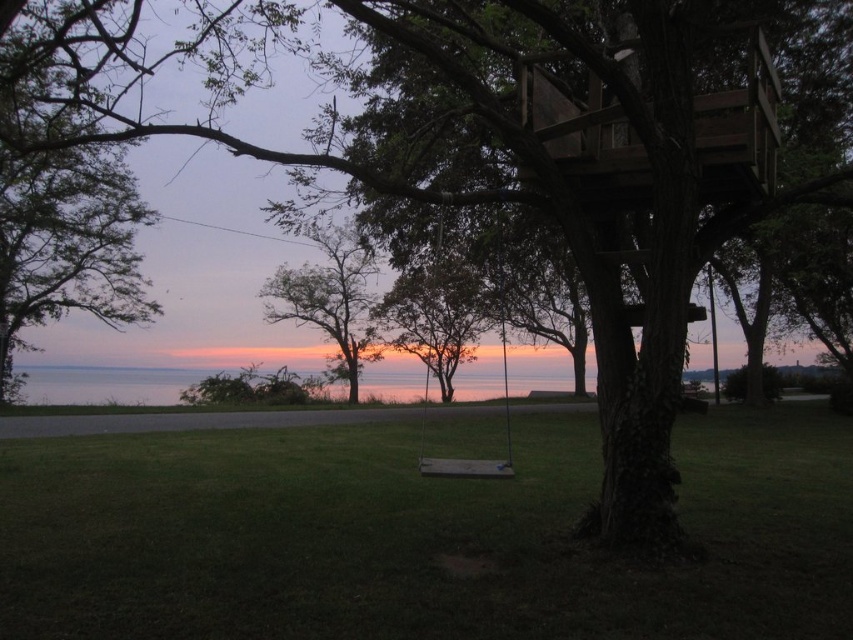
Question: Can you confirm if smooth bark tree at center is positioned to the right of wooden swing at center?

Choices:
 (A) no
 (B) yes

Answer: (A)

Question: Is smooth bark tree at center above wooden swing at center?

Choices:
 (A) yes
 (B) no

Answer: (A)

Question: Which point is closer to the camera taking this photo?

Choices:
 (A) (473, 273)
 (B) (384, 611)
 (C) (369, 344)
 (D) (503, 349)

Answer: (B)

Question: Is green grass at center below wooden swing at center?

Choices:
 (A) yes
 (B) no

Answer: (A)

Question: Which object appears farthest from the camera in this image?

Choices:
 (A) wooden swing at center
 (B) green grass at center
 (C) green leafy tree at center

Answer: (C)

Question: Based on their relative distances, which object is nearer to the green leafy tree at center?

Choices:
 (A) green grass at center
 (B) smooth bark tree at center

Answer: (B)